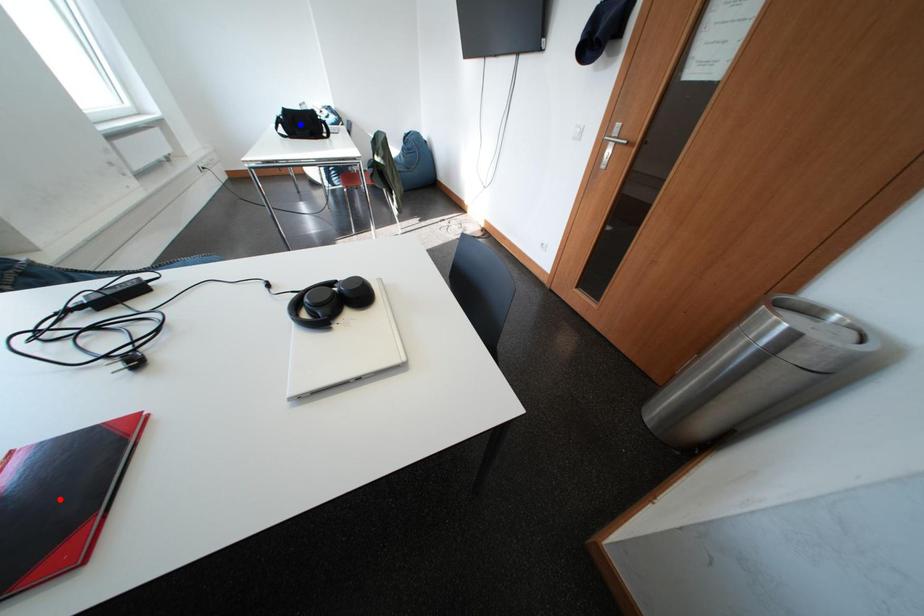
Question: In the image, two points are highlighted. Which point is nearer to the camera? Reply with the corresponding letter.

Choices:
 (A) blue point
 (B) red point

Answer: (B)